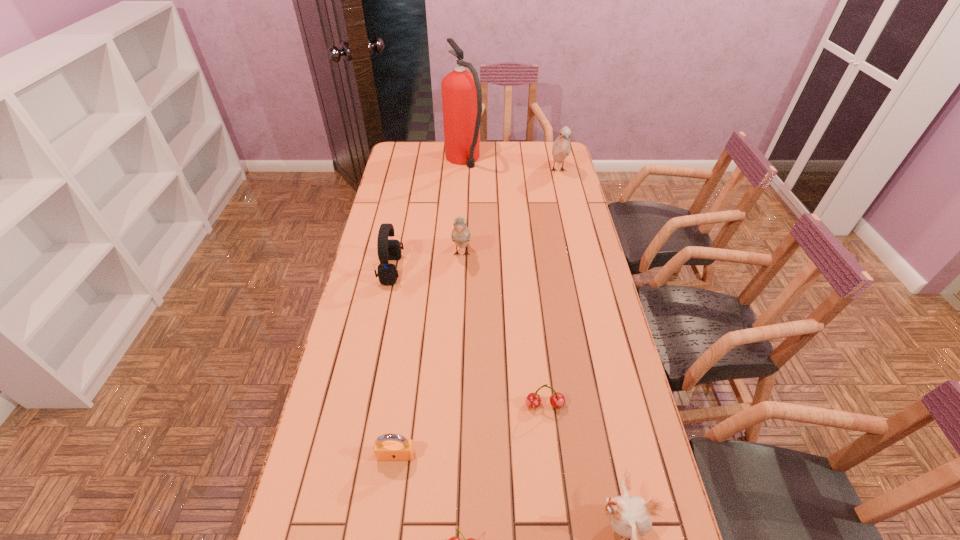
The width and height of the screenshot is (960, 540). Identify the location of the tallest object. (461, 91).

Where is `the second tallest object`? This screenshot has width=960, height=540. the second tallest object is located at coordinates (561, 148).

I want to click on the tallest bird, so click(x=561, y=148).

Locate an element on the screen. This screenshot has height=540, width=960. the leftmost bird is located at coordinates (460, 235).

Where is `the second tallest bird`? the second tallest bird is located at coordinates (460, 235).

Find the location of `the leftmost object`. the leftmost object is located at coordinates (388, 249).

This screenshot has height=540, width=960. In order to click on padlock in this screenshot , I will do `click(388, 447)`.

I want to click on the fifth farthest object, so click(x=557, y=400).

In order to click on the right cherry in this screenshot , I will do `click(557, 400)`.

Locate an element on the screen. vacant region located 0.170m at the beak of the farthest bird is located at coordinates (566, 206).